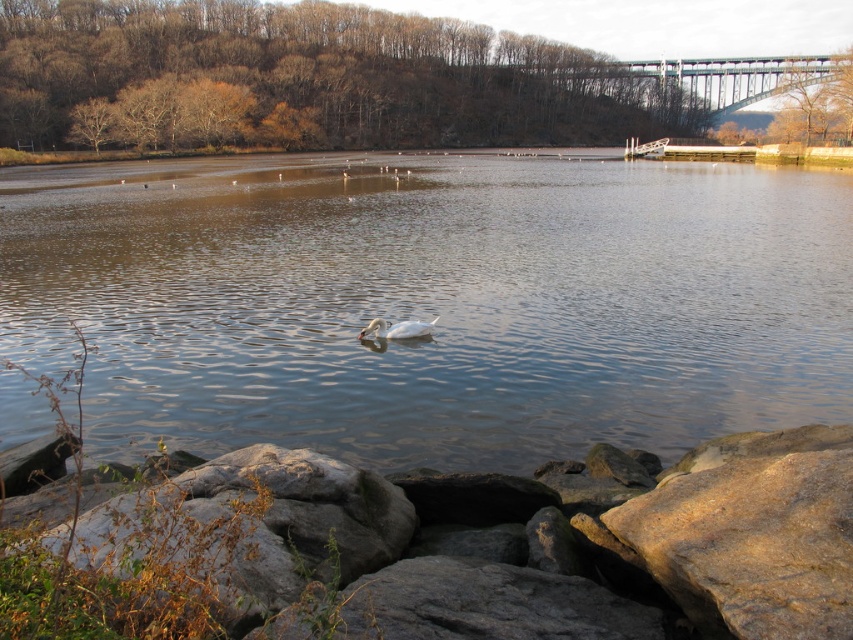
You are an ornithologist observing the lake from the shore. You notice the brown rough rock at lower center and the white glossy duck at center. Which object is wider?

The brown rough rock at lower center is wider than the white glossy duck at center.